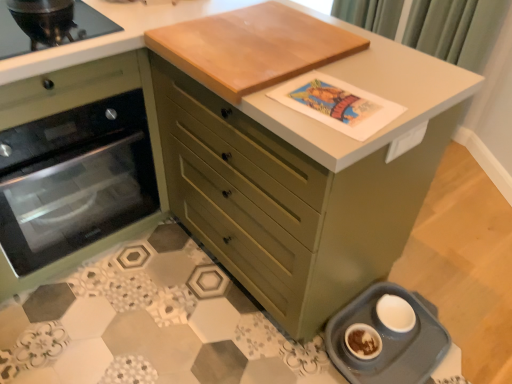
Question: Considering the positions of matte green chest of drawers at center and gray plastic pet feeder at lower right in the image, is matte green chest of drawers at center bigger or smaller than gray plastic pet feeder at lower right?

Choices:
 (A) small
 (B) big

Answer: (B)

Question: Do you think matte green chest of drawers at center is within gray plastic pet feeder at lower right, or outside of it?

Choices:
 (A) inside
 (B) outside

Answer: (B)

Question: Estimate the real-world distances between objects in this image. Which object is closer to the gray plastic pet feeder at lower right?

Choices:
 (A) green fabric curtain at upper right
 (B) light brown wood cutting board at upper center
 (C) matte green chest of drawers at center
 (D) matte green oven at left

Answer: (C)

Question: Estimate the real-world distances between objects in this image. Which object is farther from the light brown wood cutting board at upper center?

Choices:
 (A) gray plastic pet feeder at lower right
 (B) green fabric curtain at upper right
 (C) matte green chest of drawers at center
 (D) matte green oven at left

Answer: (B)